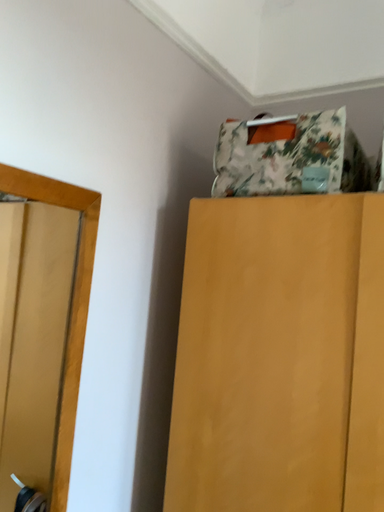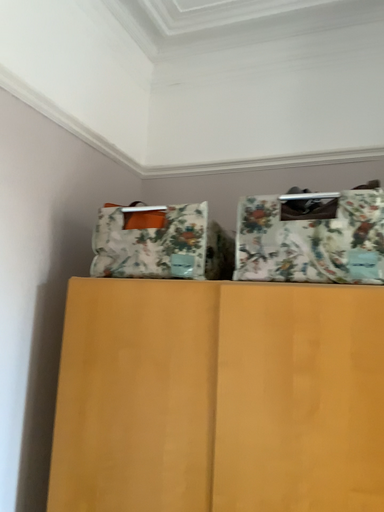
Question: Which way did the camera rotate in the video?

Choices:
 (A) rotated right
 (B) rotated left

Answer: (A)